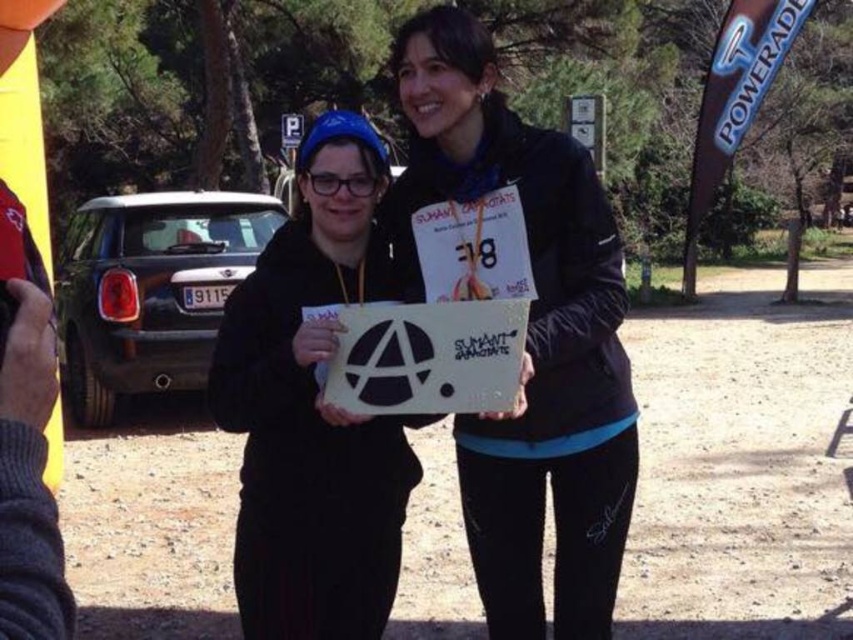
Question: Among these objects, which one is nearest to the camera?

Choices:
 (A) black matte hoodie at center
 (B) white matte sign at center
 (C) black matte jacket at center

Answer: (B)

Question: Which point is closer to the camera?

Choices:
 (A) black matte hoodie at center
 (B) black matte jacket at center

Answer: (A)

Question: Does black matte jacket at center appear under white matte sign at center?

Choices:
 (A) no
 (B) yes

Answer: (B)

Question: Does black matte jacket at center have a smaller size compared to white matte sign at center?

Choices:
 (A) no
 (B) yes

Answer: (A)

Question: Does black matte hoodie at center appear on the left side of white matte sign at center?

Choices:
 (A) no
 (B) yes

Answer: (B)

Question: Which of the following is the closest to the observer?

Choices:
 (A) pos(294,273)
 (B) pos(437,42)

Answer: (B)